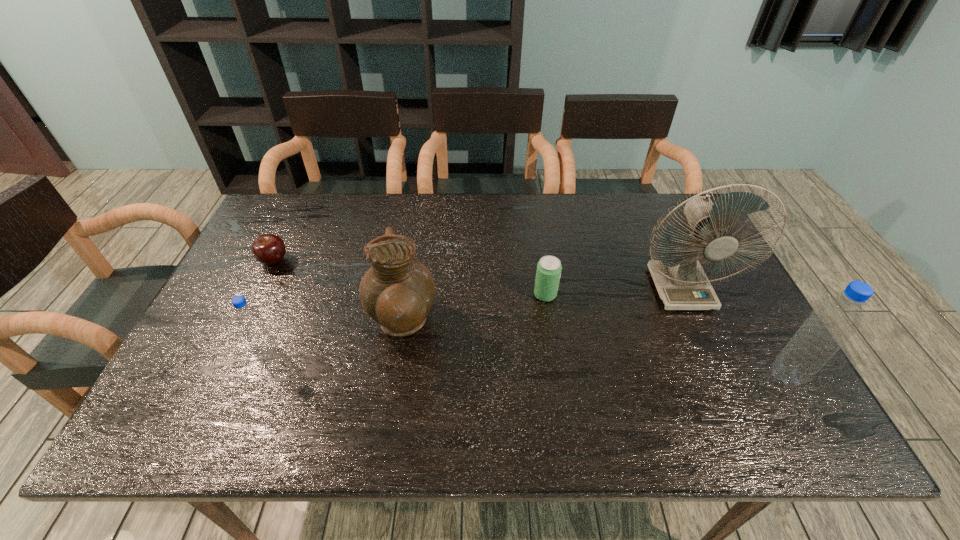
Locate an element on the screen. the shorter water bottle is located at coordinates (248, 319).

At what (x,y) coordinates should I click in order to perform the action: click on the second object from left to right. Please return your answer as a coordinate pair (x, y). Looking at the image, I should click on (248, 319).

Identify the location of the taller water bottle. (830, 324).

At what (x,y) coordinates should I click in order to perform the action: click on apple. Please return your answer as a coordinate pair (x, y). This screenshot has height=540, width=960. Looking at the image, I should click on (269, 249).

Identify the location of the shortest object. (269, 249).

Locate an element on the screen. The width and height of the screenshot is (960, 540). the second shortest object is located at coordinates (548, 272).

I want to click on the fourth object from left to right, so click(x=548, y=272).

The height and width of the screenshot is (540, 960). I want to click on fan, so click(680, 280).

The width and height of the screenshot is (960, 540). I want to click on the fourth object from right to left, so click(x=397, y=292).

Locate an element on the screen. free space located 0.240m on the back of the left water bottle is located at coordinates (300, 277).